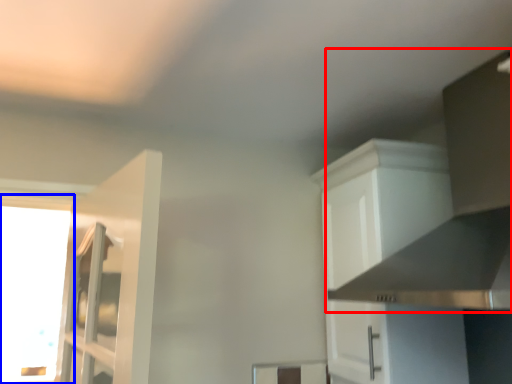
Question: Which object appears closest to the camera in this image, vent (highlighted by a red box) or window (highlighted by a blue box)?

Choices:
 (A) vent
 (B) window

Answer: (A)